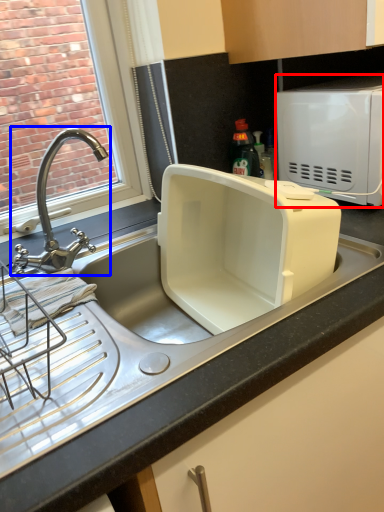
Question: Which object appears closest to the camera in this image, microwave oven (highlighted by a red box) or tap (highlighted by a blue box)?

Choices:
 (A) microwave oven
 (B) tap

Answer: (B)